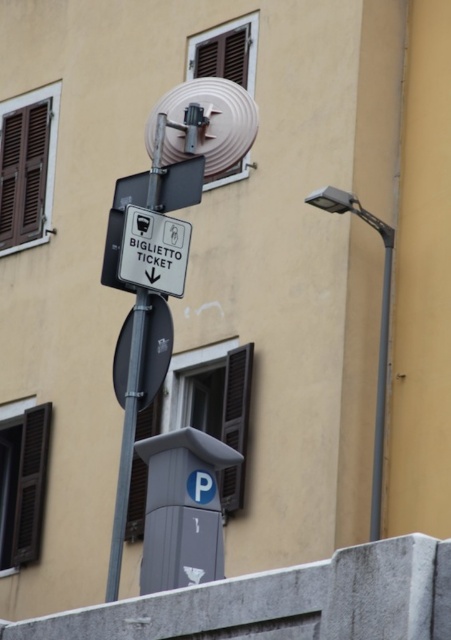
Question: Which of the following is the farthest from the observer?

Choices:
 (A) metallic pole at center
 (B) gray plastic parking sign at lower center

Answer: (B)

Question: Is gray plastic parking sign at lower center above metallic pole at center?

Choices:
 (A) no
 (B) yes

Answer: (A)

Question: Can you confirm if gray plastic parking sign at lower center is smaller than metallic pole at center?

Choices:
 (A) no
 (B) yes

Answer: (B)

Question: Which point is farther from the camera taking this photo?

Choices:
 (A) (127, 401)
 (B) (216, 544)

Answer: (A)

Question: Among these points, which one is nearest to the camera?

Choices:
 (A) (127, 492)
 (B) (153, 554)

Answer: (B)

Question: Is the position of gray plastic parking sign at lower center more distant than that of metallic pole at center?

Choices:
 (A) yes
 (B) no

Answer: (A)